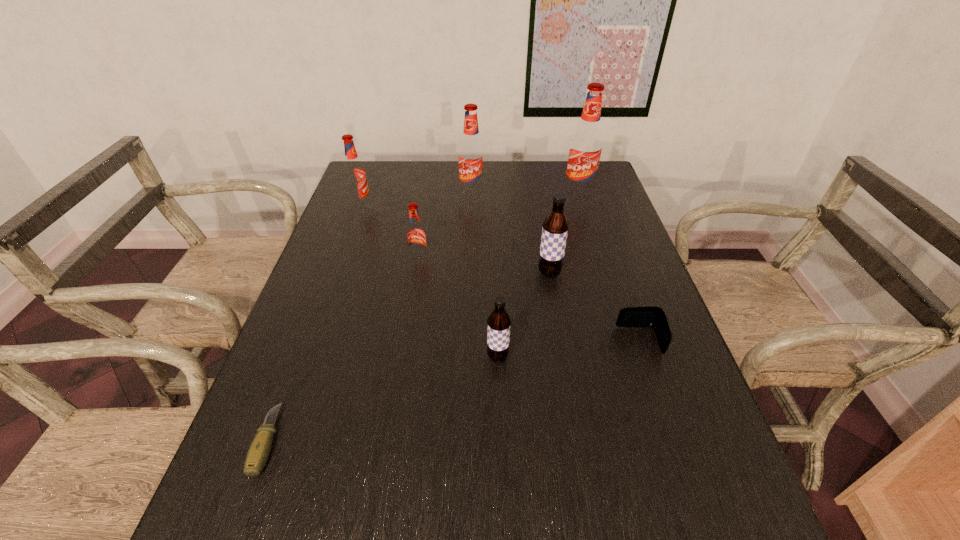
Locate an element on the screen. the fourth root beer from left to right is located at coordinates [x=499, y=322].

Where is `the fourth object from right to left`? The image size is (960, 540). the fourth object from right to left is located at coordinates (499, 322).

Where is `wallet`? The width and height of the screenshot is (960, 540). wallet is located at coordinates (650, 316).

This screenshot has width=960, height=540. Find the location of `the nearest object`. the nearest object is located at coordinates (259, 450).

Where is `the shortest object`? The height and width of the screenshot is (540, 960). the shortest object is located at coordinates (259, 450).

At what (x,y) coordinates should I click in order to perform the action: click on vacant space located on the front of the rightmost red root beer. Please return your answer as a coordinate pair (x, y). Looking at the image, I should click on (590, 232).

The width and height of the screenshot is (960, 540). I want to click on vacant space situated on the left of the second tallest object, so click(x=383, y=193).

Locate an element on the screen. The height and width of the screenshot is (540, 960). free space located 0.350m on the left of the second root beer from right to left is located at coordinates (407, 273).

Find the location of `vacant space located on the right of the leftmost red root beer`. vacant space located on the right of the leftmost red root beer is located at coordinates 448,206.

Where is `free location located on the front of the smallest red root beer`? Image resolution: width=960 pixels, height=540 pixels. free location located on the front of the smallest red root beer is located at coordinates (416, 280).